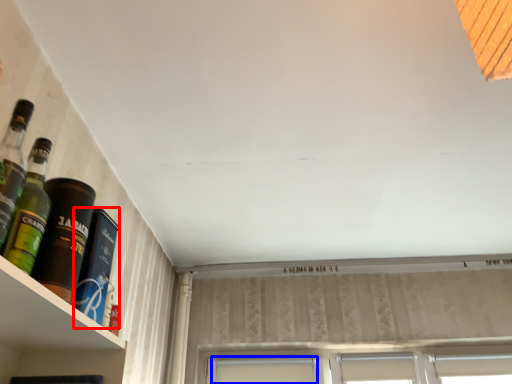
Question: Which of the following is the closest to the observer, bottle (highlighted by a red box) or window (highlighted by a blue box)?

Choices:
 (A) bottle
 (B) window

Answer: (A)